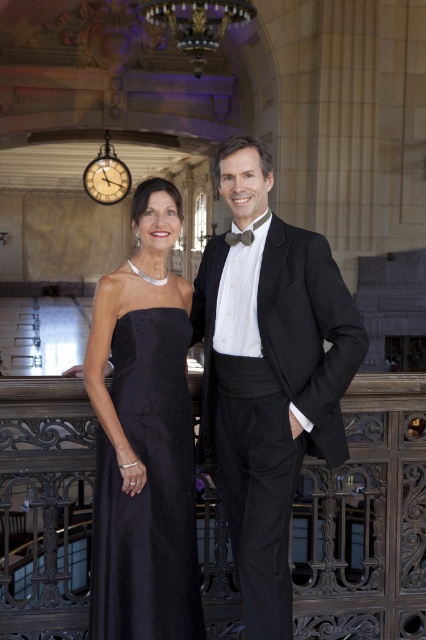
Question: Which object appears closest to the camera in this image?

Choices:
 (A) textured brown bow tie at center
 (B) shiny black tuxedo at center
 (C) satin/black dress at center

Answer: (B)

Question: Which point is closer to the camera?

Choices:
 (A) satin/black dress at center
 (B) textured brown bow tie at center

Answer: (A)

Question: Can you confirm if shiny black tuxedo at center is positioned to the right of satin/black dress at center?

Choices:
 (A) yes
 (B) no

Answer: (A)

Question: Does satin/black dress at center have a greater width compared to textured brown bow tie at center?

Choices:
 (A) no
 (B) yes

Answer: (B)

Question: Does shiny black tuxedo at center appear under textured brown bow tie at center?

Choices:
 (A) yes
 (B) no

Answer: (A)

Question: Which point is closer to the camera taking this photo?

Choices:
 (A) pos(192,595)
 (B) pos(232,244)

Answer: (A)